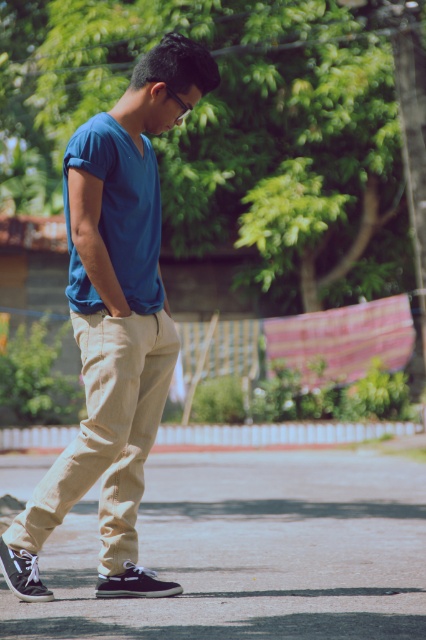
Between matte asphalt pavement at lower center and matte blue shirt at center, which one has less height?

Standing shorter between the two is matte asphalt pavement at lower center.

The width and height of the screenshot is (426, 640). Identify the location of matte asphalt pavement at lower center. (250, 552).